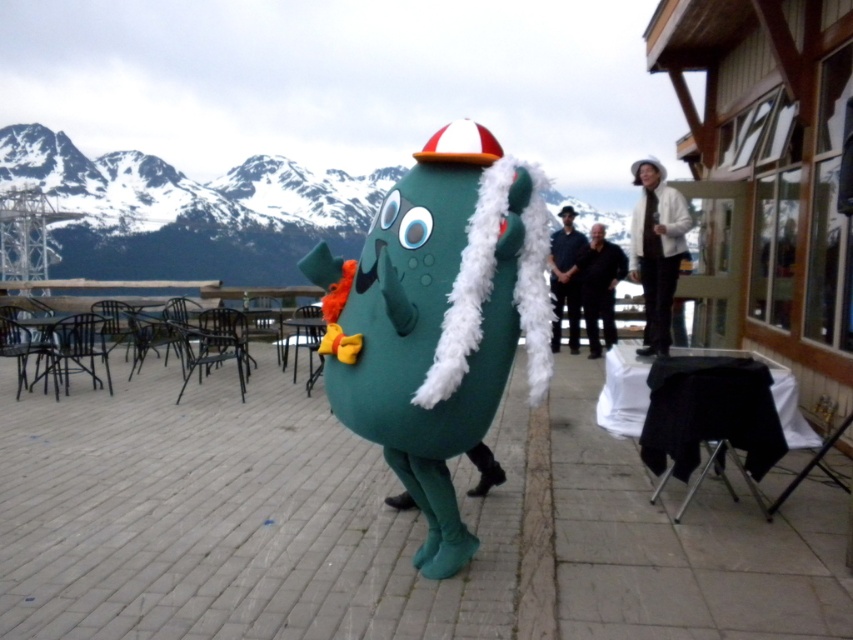
Question: Which of these objects is positioned closest to the white woolen coat at upper right?

Choices:
 (A) smooth concrete pavement at center
 (B) green fabric costume at center
 (C) dark blue suit at center

Answer: (C)

Question: Estimate the real-world distances between objects in this image. Which object is farther from the dark blue suit at center?

Choices:
 (A) green fabric costume at center
 (B) black smooth pants at center

Answer: (A)

Question: Can you confirm if green fabric costume at center is smaller than black smooth pants at center?

Choices:
 (A) yes
 (B) no

Answer: (A)

Question: Estimate the real-world distances between objects in this image. Which object is farther from the green fabric costume at center?

Choices:
 (A) dark blue suit at center
 (B) white woolen coat at upper right

Answer: (A)

Question: Is green fabric costume at center thinner than black smooth pants at center?

Choices:
 (A) no
 (B) yes

Answer: (B)

Question: Is smooth concrete pavement at center in front of black smooth pants at center?

Choices:
 (A) yes
 (B) no

Answer: (A)